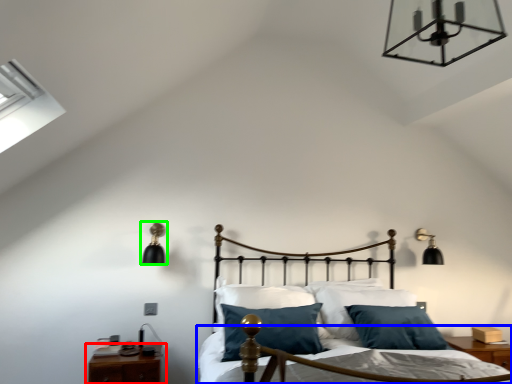
Question: Estimate the real-world distances between objects in this image. Which object is closer to nightstand (highlighted by a red box), bed frame (highlighted by a blue box) or lamp (highlighted by a green box)?

Choices:
 (A) bed frame
 (B) lamp

Answer: (B)